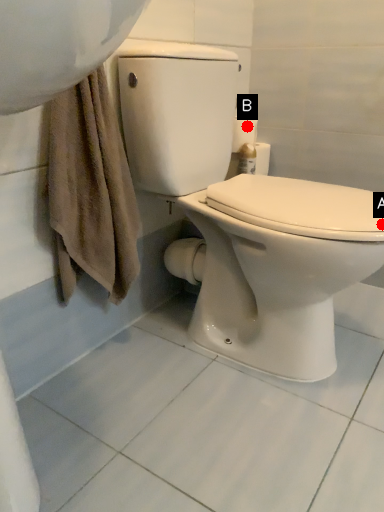
Question: Two points are circled on the image, labeled by A and B beside each circle. Which of the following is the closest to the observer?

Choices:
 (A) A is closer
 (B) B is closer

Answer: (A)